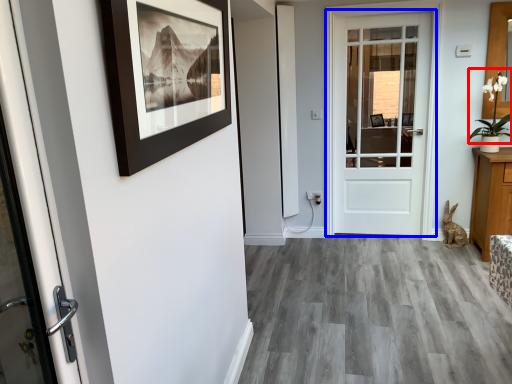
Question: Which object appears farthest to the camera in this image, plant (highlighted by a red box) or door (highlighted by a blue box)?

Choices:
 (A) plant
 (B) door

Answer: (B)